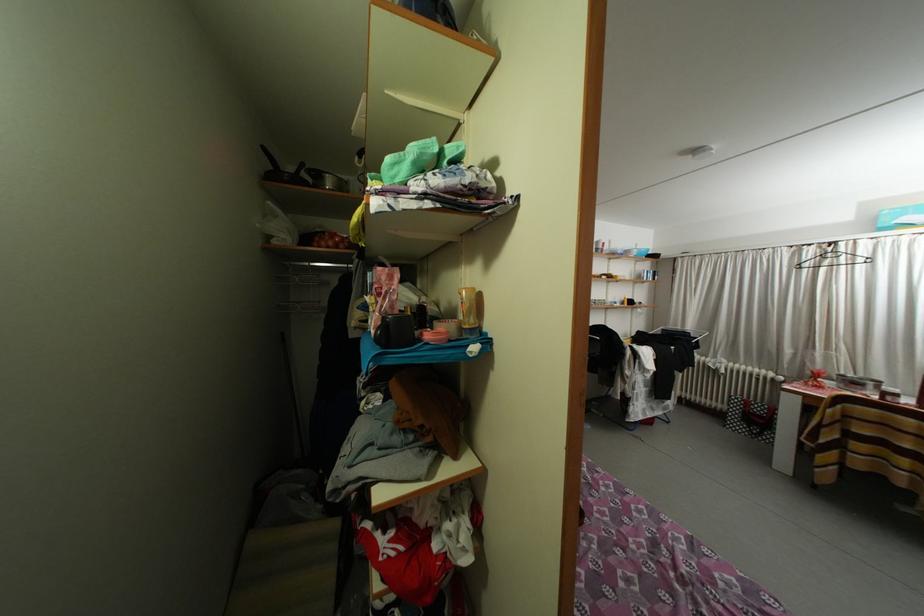
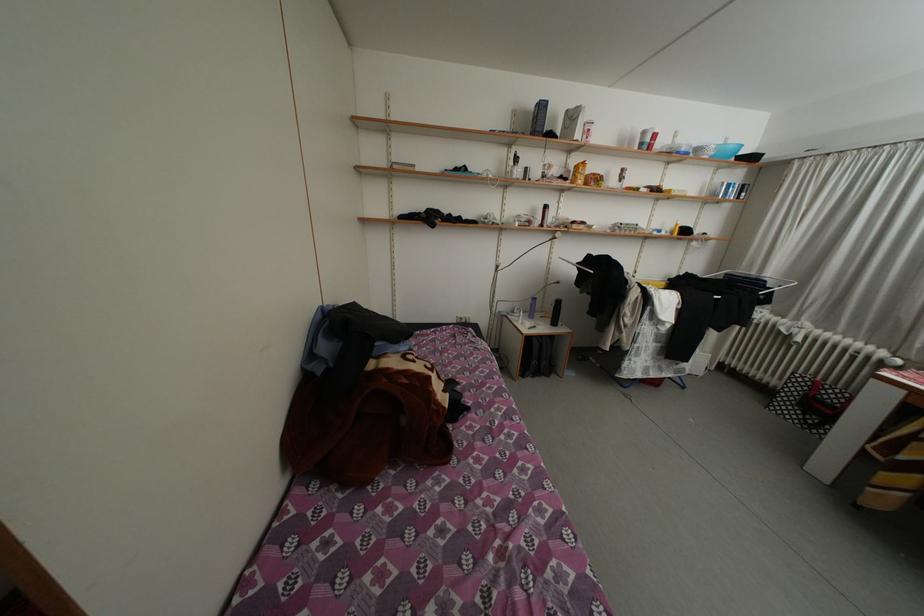
Which direction would the cameraman need to move to produce the second image?

The cameraman walked toward right, forward.